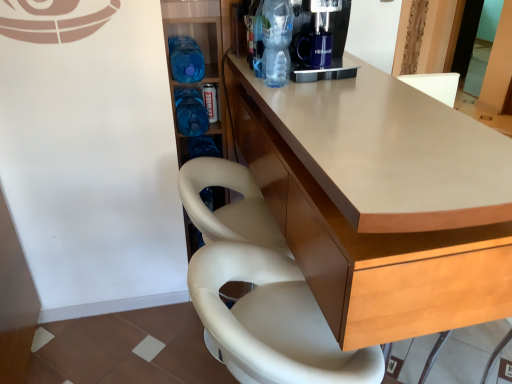
Question: Can you confirm if blue plastic water bottles at left is smaller than matte wood counter at center?

Choices:
 (A) yes
 (B) no

Answer: (A)

Question: Is blue plastic water bottles at left outside of matte wood counter at center?

Choices:
 (A) no
 (B) yes

Answer: (B)

Question: From the image's perspective, is blue plastic water bottles at left on matte wood counter at center?

Choices:
 (A) no
 (B) yes

Answer: (B)

Question: Is blue plastic water bottles at left taller than matte wood counter at center?

Choices:
 (A) no
 (B) yes

Answer: (B)

Question: Considering the relative positions of blue plastic water bottles at left and matte wood counter at center in the image provided, is blue plastic water bottles at left to the right of matte wood counter at center from the viewer's perspective?

Choices:
 (A) no
 (B) yes

Answer: (A)

Question: Can you confirm if blue plastic water bottles at left is wider than matte wood counter at center?

Choices:
 (A) no
 (B) yes

Answer: (A)

Question: Is blue plastic bottle at center-left, marked as the 2th bottle in a front-to-back arrangement, not near blue plastic bottle at center-left, which is the second bottle in left-to-right order?

Choices:
 (A) no
 (B) yes

Answer: (A)

Question: Is blue plastic bottle at center-left, the second bottle positioned from the back, directly adjacent to blue plastic bottle at center-left, placed as the third bottle when sorted from front to back?

Choices:
 (A) yes
 (B) no

Answer: (B)

Question: From the image's perspective, does blue plastic bottle at center-left, the 3th bottle positioned from the right, appear higher than blue plastic bottle at center-left, acting as the first bottle starting from the back?

Choices:
 (A) no
 (B) yes

Answer: (B)

Question: Considering the relative positions of blue plastic bottle at center-left, the 3th bottle positioned from the right, and blue plastic bottle at center-left, placed as the third bottle when sorted from front to back, in the image provided, is blue plastic bottle at center-left, the 3th bottle positioned from the right, in front of blue plastic bottle at center-left, placed as the third bottle when sorted from front to back,?

Choices:
 (A) yes
 (B) no

Answer: (A)

Question: From a real-world perspective, does blue plastic bottle at center-left, the 3th bottle positioned from the right, stand above blue plastic bottle at center-left, arranged as the 2th bottle when viewed from the right?

Choices:
 (A) no
 (B) yes

Answer: (B)

Question: Can you confirm if blue plastic bottle at center-left, the second bottle positioned from the back, is taller than blue plastic bottle at center-left, which is the second bottle in left-to-right order?

Choices:
 (A) no
 (B) yes

Answer: (A)

Question: Does blue plastic bottle at center-left, which is the second bottle in left-to-right order, have a lesser width compared to white leather chair at lower center?

Choices:
 (A) no
 (B) yes

Answer: (B)